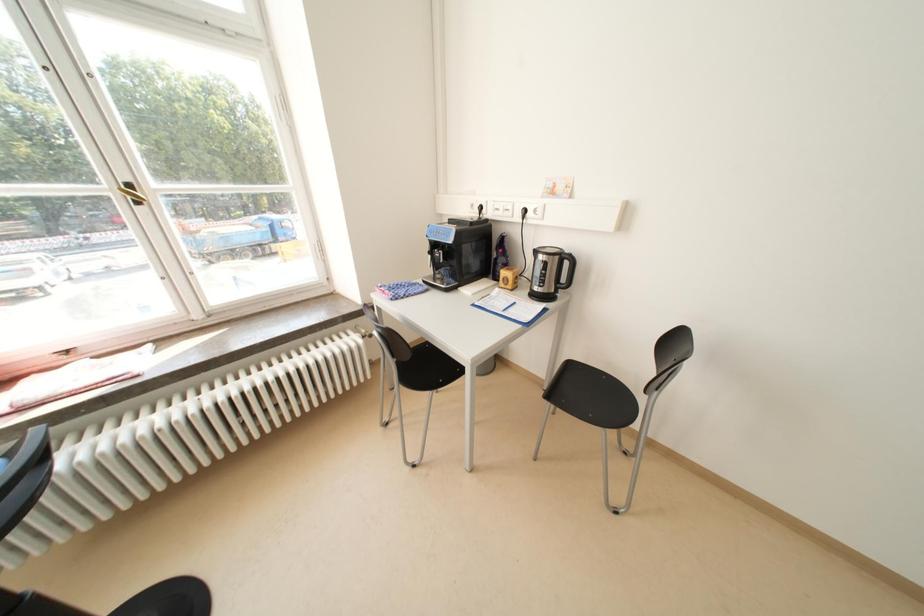
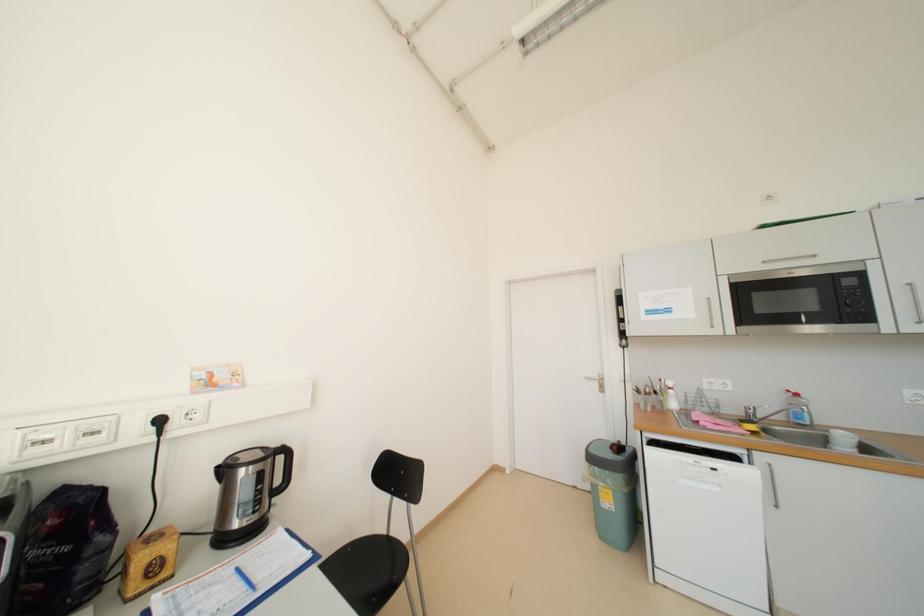
Question: How did the camera likely rotate?

Choices:
 (A) Left
 (B) Right
 (C) Up
 (D) Down

Answer: (B)